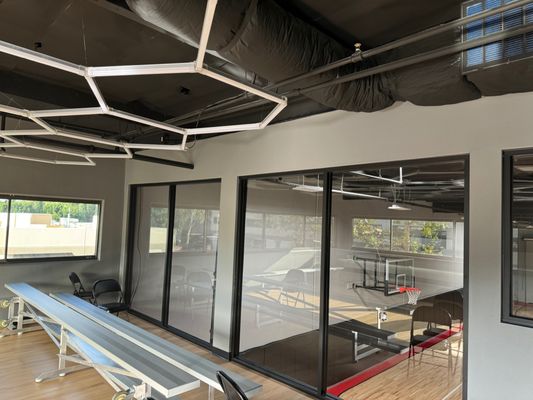
Locate an element on the screen. grey wall is located at coordinates (348, 140).